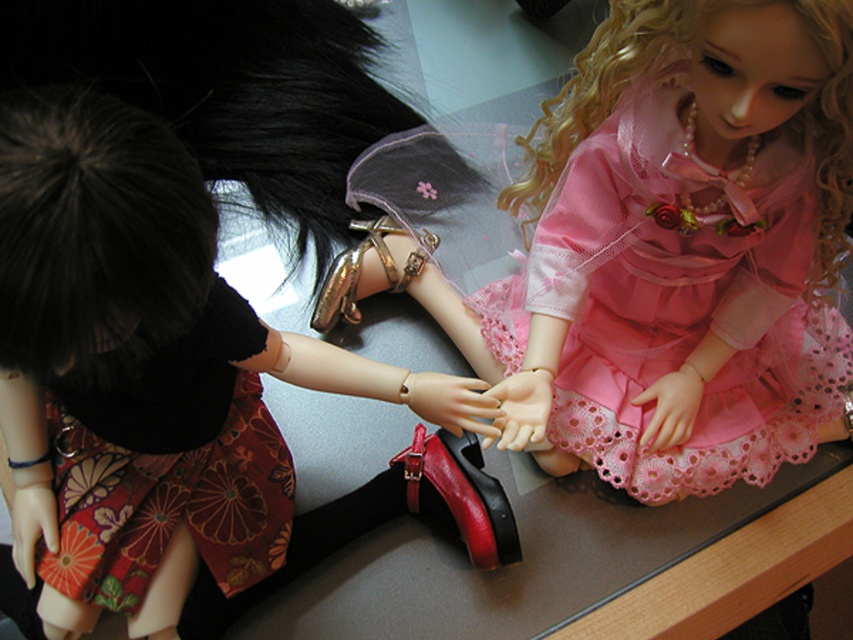
You are a toy store employee who needs to place the matte black doll at center and the floral silk skirt at lower left on a shelf. The shelf has a height limit of 12 inches. Can you determine if both items will fit vertically on the shelf based on their sizes?

The matte black doll at center is larger than the floral silk skirt at lower left. However, the exact height of the doll is not provided, so it is uncertain if it will exceed the 12 inch height limit. Additional measurements are needed to confirm.

You are a delivery robot with a 12 inch wide package. You need to place the package between the floral silk skirt at lower left and the shiny red leather shoe at center. Is there enough space to fit the package between them?

The distance between the floral silk skirt at lower left and the shiny red leather shoe at center is 14.00 inches. Since the package is 12 inches wide, there is enough space to fit it between them.

You are a toy collector looking at the dolls on the glass surface. You need to place a small decorative item between the matte black doll at center and the floral silk skirt at lower left. Based on their positions, where should you place it?

The matte black doll at center is to the right of the floral silk skirt at lower left, so you should place the decorative item between them on the left side of the matte black doll at center and the right side of the floral silk skirt at lower left.